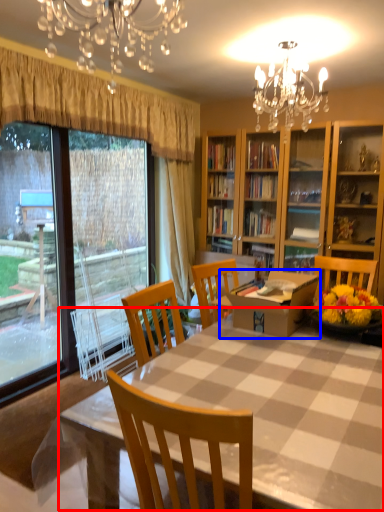
Question: Which of the following is the farthest to the observer, kitchen & dining room table (highlighted by a red box) or round table (highlighted by a blue box)?

Choices:
 (A) kitchen & dining room table
 (B) round table

Answer: (B)